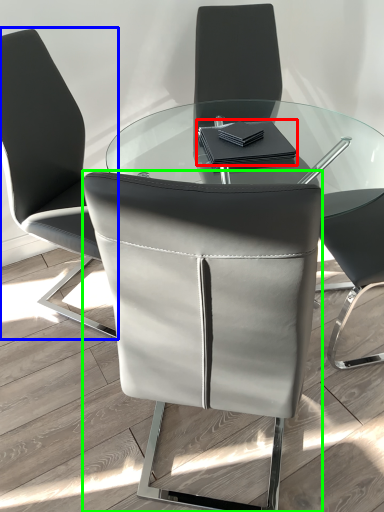
Question: Which object is the farthest from notebook (highlighted by a red box)? Choose among these: chair (highlighted by a blue box) or chair (highlighted by a green box).

Choices:
 (A) chair
 (B) chair

Answer: (B)